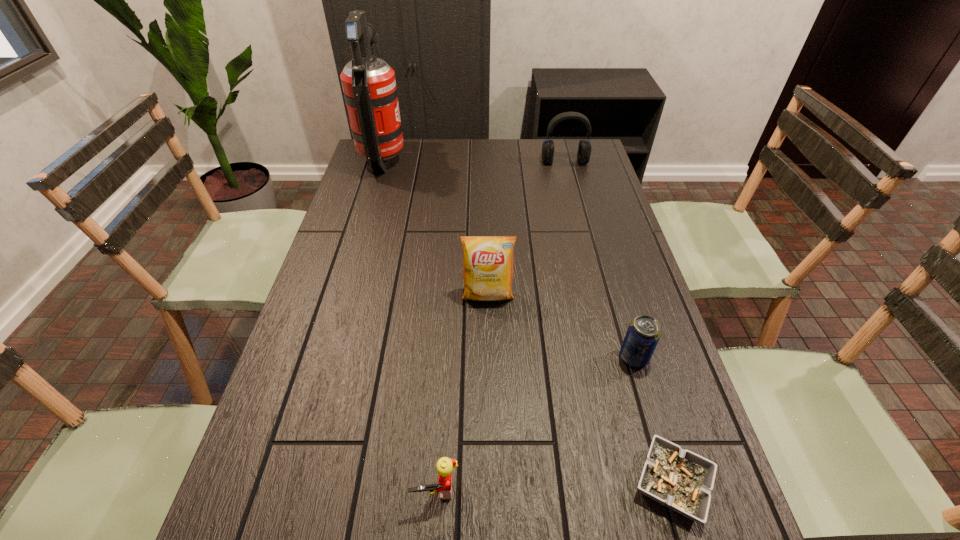
Find the location of a particular element. The image size is (960, 540). the leftmost object is located at coordinates (369, 86).

You are a GUI agent. You are given a task and a screenshot of the screen. Output one action in this format:
    pyautogui.click(x=<x>, y=<y>)
    Task: Click on the fire extinguisher
    Image resolution: width=960 pixels, height=540 pixels.
    Given the screenshot: What is the action you would take?
    pyautogui.click(x=369, y=86)

Where is `headset`? headset is located at coordinates (584, 149).

What are the coordinates of `the third farthest object` in the screenshot? It's located at (487, 260).

Image resolution: width=960 pixels, height=540 pixels. I want to click on soda, so click(x=644, y=332).

At what (x,y) coordinates should I click in order to perform the action: click on Lego. Please return your answer as a coordinate pair (x, y). Looking at the image, I should click on (445, 465).

In order to click on ashtray in this screenshot , I will do `click(681, 480)`.

Locate an element on the screen. free point located 0.080m on the front label side of the fire extinguisher is located at coordinates (427, 159).

This screenshot has height=540, width=960. I want to click on blank space located 0.270m on the headband of the headset, so tap(577, 211).

Where is `vacant space positioned 0.070m on the front-facing side of the third farthest object`? vacant space positioned 0.070m on the front-facing side of the third farthest object is located at coordinates (489, 328).